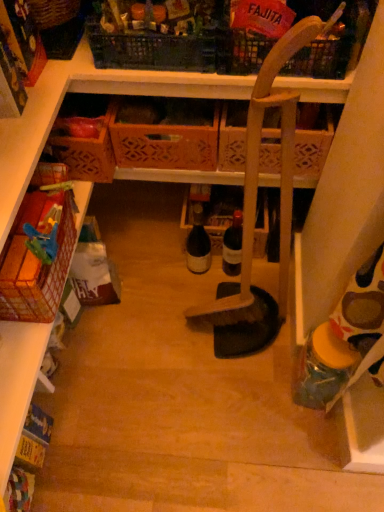
This screenshot has width=384, height=512. In order to click on free space in front of translucent plastic jar at lower right, acting as the second bottle starting from the top in this screenshot , I will do `click(311, 443)`.